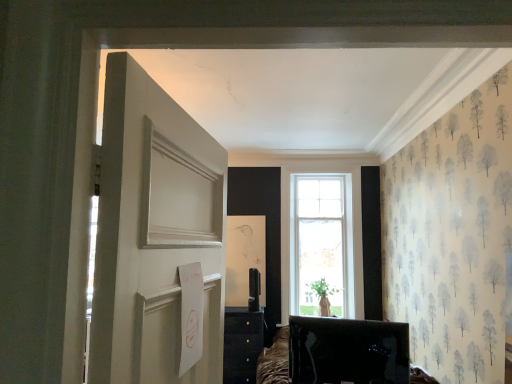
Question: Is white painted wood door at left completely or partially outside of matte black tv at lower center?

Choices:
 (A) no
 (B) yes

Answer: (B)

Question: Can you confirm if white painted wood door at left is wider than matte black tv at lower center?

Choices:
 (A) no
 (B) yes

Answer: (A)

Question: Is white painted wood door at left not near matte black tv at lower center?

Choices:
 (A) no
 (B) yes

Answer: (B)

Question: Does white painted wood door at left have a greater height compared to matte black tv at lower center?

Choices:
 (A) yes
 (B) no

Answer: (A)

Question: Does white painted wood door at left turn towards matte black tv at lower center?

Choices:
 (A) no
 (B) yes

Answer: (A)

Question: Is white painted wood door at left behind matte black tv at lower center?

Choices:
 (A) no
 (B) yes

Answer: (A)

Question: Considering the relative sizes of matte black tv at lower center and white painted wood door at left in the image provided, is matte black tv at lower center shorter than white painted wood door at left?

Choices:
 (A) yes
 (B) no

Answer: (A)

Question: Is matte black tv at lower center smaller than white painted wood door at left?

Choices:
 (A) yes
 (B) no

Answer: (A)

Question: Would you say matte black tv at lower center contains white painted wood door at left?

Choices:
 (A) yes
 (B) no

Answer: (B)

Question: From a real-world perspective, is matte black tv at lower center located beneath white painted wood door at left?

Choices:
 (A) yes
 (B) no

Answer: (A)

Question: Is matte black tv at lower center positioned far away from white painted wood door at left?

Choices:
 (A) yes
 (B) no

Answer: (A)

Question: Is the position of matte black tv at lower center less distant than that of white painted wood door at left?

Choices:
 (A) yes
 (B) no

Answer: (B)

Question: From a real-world perspective, is white painted wood door at left positioned above or below matte black tv at lower center?

Choices:
 (A) above
 (B) below

Answer: (A)